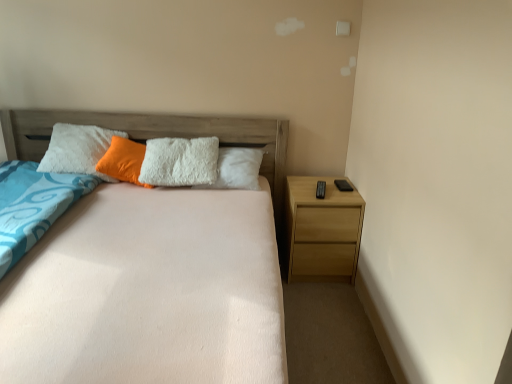
Question: Does point pos(22,140) appear closer or farther from the camera than point pos(117,152)?

Choices:
 (A) farther
 (B) closer

Answer: (A)

Question: Is peach soft fabric bed at center inside the boundaries of orange fuzzy pillow at center, or outside?

Choices:
 (A) inside
 (B) outside

Answer: (B)

Question: Which object is positioned farthest from the light brown wood nightstand at right?

Choices:
 (A) peach soft fabric bed at center
 (B) orange fuzzy pillow at center

Answer: (B)

Question: Estimate the real-world distances between objects in this image. Which object is farther from the orange fuzzy pillow at center?

Choices:
 (A) peach soft fabric bed at center
 (B) light brown wood nightstand at right

Answer: (B)